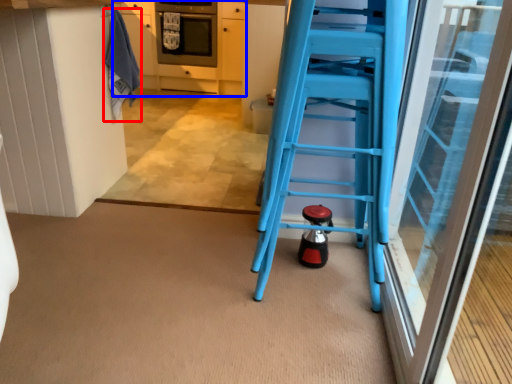
Question: Which point is closer to the camera, laundry (highlighted by a red box) or cabinetry (highlighted by a blue box)?

Choices:
 (A) laundry
 (B) cabinetry

Answer: (A)